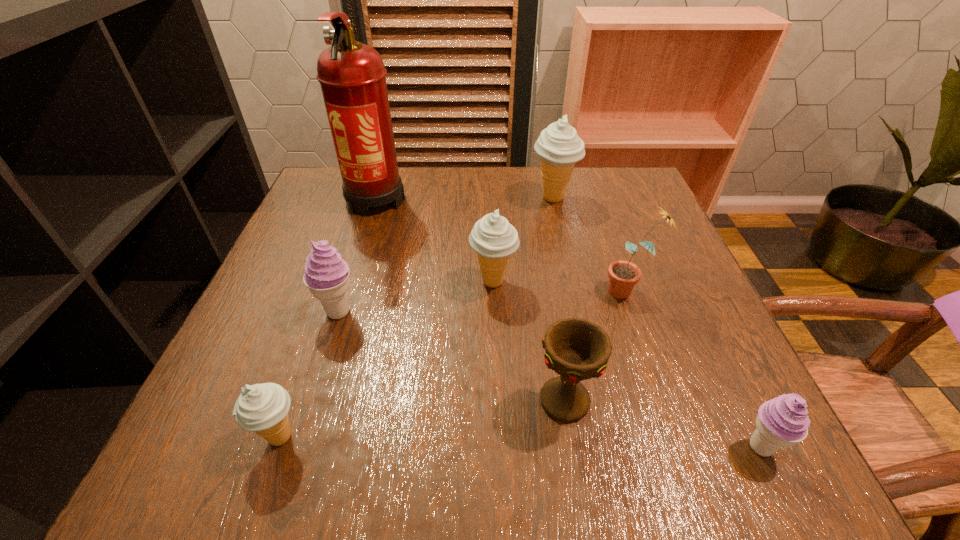
Find the location of `object situated at the far left corner`. object situated at the far left corner is located at coordinates (352, 76).

This screenshot has height=540, width=960. Identify the location of object located in the near left corner section of the desktop. (263, 408).

Where is `object that is positioned at the near right corner`? object that is positioned at the near right corner is located at coordinates (781, 422).

Locate an element on the screen. This screenshot has width=960, height=540. vacant space at the far edge of the desktop is located at coordinates (588, 213).

I want to click on vacant space at the near edge, so click(582, 455).

Locate an element on the screen. vacant space at the left edge of the desktop is located at coordinates (288, 307).

The height and width of the screenshot is (540, 960). I want to click on vacant space at the right edge, so click(x=661, y=227).

You are a GUI agent. You are given a task and a screenshot of the screen. Output one action in this format:
    pyautogui.click(x=<x>, y=<y>)
    Task: Click on the vacant region at the near left corner of the desktop
    
    Given the screenshot: What is the action you would take?
    pyautogui.click(x=273, y=474)

Locate an element on the screen. The image size is (960, 540). free spot at the far right corner of the desktop is located at coordinates (619, 184).

Image resolution: width=960 pixels, height=540 pixels. I want to click on free space at the near right corner, so click(759, 463).